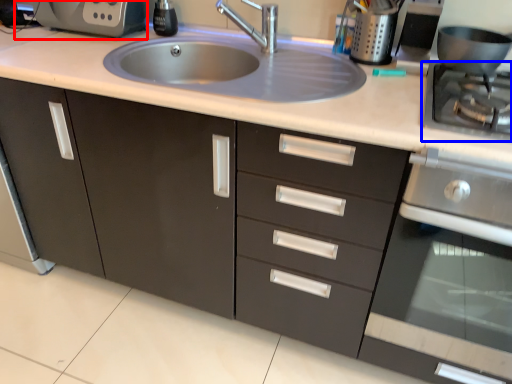
Question: Which of the following is the closest to the observer, coffee machine (highlighted by a red box) or gas stove (highlighted by a blue box)?

Choices:
 (A) coffee machine
 (B) gas stove

Answer: (B)